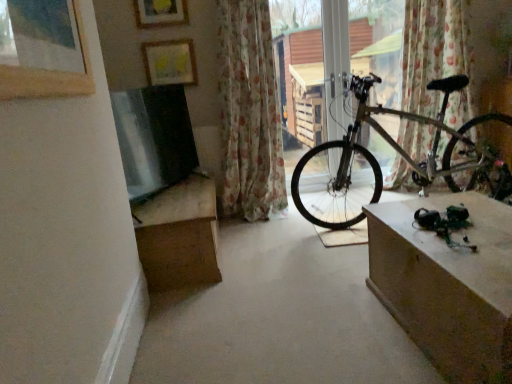
Question: Does concretesmoothconcrete at center come behind metallic silver bicycle at center?

Choices:
 (A) yes
 (B) no

Answer: (B)

Question: Is concretesmoothconcrete at center oriented towards metallic silver bicycle at center?

Choices:
 (A) no
 (B) yes

Answer: (A)

Question: Does concretesmoothconcrete at center have a greater height compared to metallic silver bicycle at center?

Choices:
 (A) yes
 (B) no

Answer: (B)

Question: From the image's perspective, would you say concretesmoothconcrete at center is shown under metallic silver bicycle at center?

Choices:
 (A) yes
 (B) no

Answer: (A)

Question: Considering the relative sizes of concretesmoothconcrete at center and metallic silver bicycle at center in the image provided, is concretesmoothconcrete at center smaller than metallic silver bicycle at center?

Choices:
 (A) no
 (B) yes

Answer: (B)

Question: From the image's perspective, relative to floral fabric curtain at center, positioned as the second curtain in right-to-left order, is concretesmoothconcrete at center above or below?

Choices:
 (A) above
 (B) below

Answer: (B)

Question: Looking at their shapes, would you say concretesmoothconcrete at center is wider or thinner than floral fabric curtain at center, positioned as the second curtain in right-to-left order?

Choices:
 (A) thin
 (B) wide

Answer: (B)

Question: From a real-world perspective, is concretesmoothconcrete at center physically located above or below floral fabric curtain at center, the 1th curtain in the left-to-right sequence?

Choices:
 (A) above
 (B) below

Answer: (B)

Question: Considering the positions of concretesmoothconcrete at center and floral fabric curtain at center, the 1th curtain in the left-to-right sequence, in the image, is concretesmoothconcrete at center taller or shorter than floral fabric curtain at center, the 1th curtain in the left-to-right sequence,?

Choices:
 (A) tall
 (B) short

Answer: (B)

Question: Based on their sizes in the image, would you say wooden frame at upper center, placed as the second picture frame when sorted from back to front, is bigger or smaller than concretesmoothconcrete at center?

Choices:
 (A) small
 (B) big

Answer: (A)

Question: From the image's perspective, is wooden frame at upper center, which is counted as the third picture frame, starting from the bottom, positioned above or below concretesmoothconcrete at center?

Choices:
 (A) above
 (B) below

Answer: (A)

Question: Is wooden frame at upper center, which is counted as the third picture frame, starting from the bottom, situated inside concretesmoothconcrete at center or outside?

Choices:
 (A) outside
 (B) inside

Answer: (A)

Question: In the image, is wooden frame at upper center, which is counted as the third picture frame, starting from the bottom, on the left side or the right side of concretesmoothconcrete at center?

Choices:
 (A) right
 (B) left

Answer: (B)

Question: Based on their positions, is concretesmoothconcrete at center located to the left or right of matte brown table at right?

Choices:
 (A) right
 (B) left

Answer: (B)

Question: From a real-world perspective, relative to matte brown table at right, is concretesmoothconcrete at center vertically above or below?

Choices:
 (A) above
 (B) below

Answer: (B)